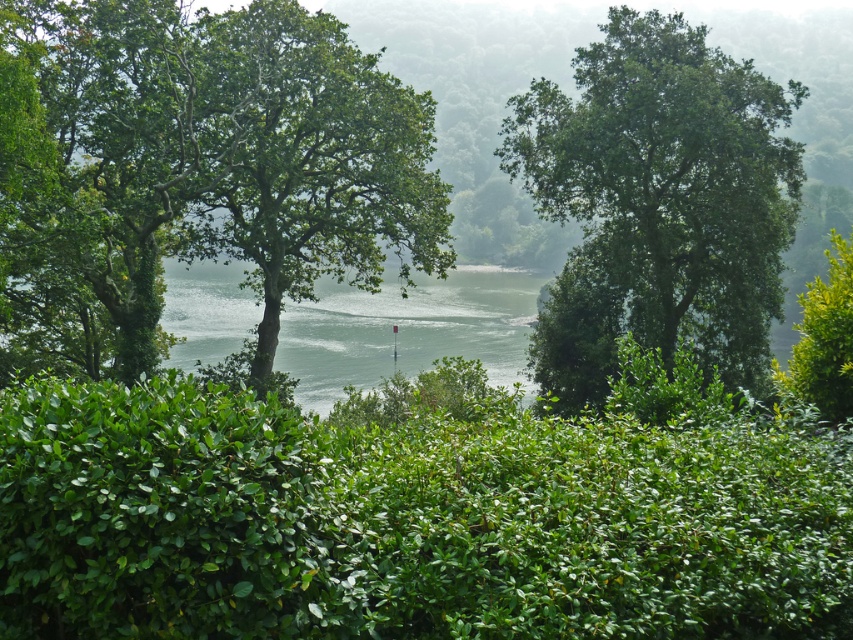
Does point (160, 556) lie in front of point (561, 186)?

Yes, it is.

Between point (386, 636) and point (639, 182), which one is positioned in front?

Positioned in front is point (386, 636).

Where is `green leafy hedge at center`? The width and height of the screenshot is (853, 640). green leafy hedge at center is located at coordinates (416, 515).

Between green leafy tree at center and clear water at center, which one appears on the left side from the viewer's perspective?

Positioned to the left is green leafy tree at center.

Which of these two, green leafy tree at center or clear water at center, stands taller?

green leafy tree at center is taller.

Is point (190, 244) more distant than point (524, 332)?

No, it is not.

In order to click on green leafy tree at center in this screenshot , I will do `click(314, 164)`.

Which is behind, point (107, 570) or point (431, 358)?

The point (431, 358) is behind.

Which of these two, green leafy hedge at center or clear water at center, stands shorter?

With less height is green leafy hedge at center.

Which is in front, point (688, 422) or point (334, 385)?

Point (688, 422)

You are a GUI agent. You are given a task and a screenshot of the screen. Output one action in this format:
    pyautogui.click(x=<x>, y=<y>)
    Task: Click on the green leafy hedge at center
    This screenshot has height=640, width=853.
    Given the screenshot: What is the action you would take?
    pyautogui.click(x=416, y=515)